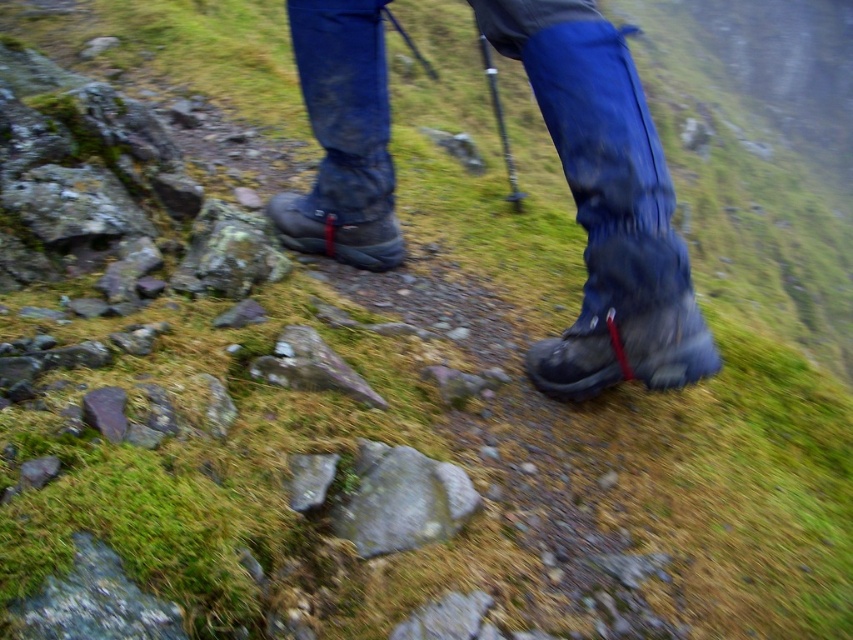
You are a hiker trying to place your boots on the ground. Which boot, the matte black boot at lower right or the matte black boot at center, is positioned more to the east if you are facing north?

The matte black boot at lower right is positioned to the right of the matte black boot at center. Since you are facing north, the right side corresponds to the east direction. Therefore, the matte black boot at lower right is more to the east.